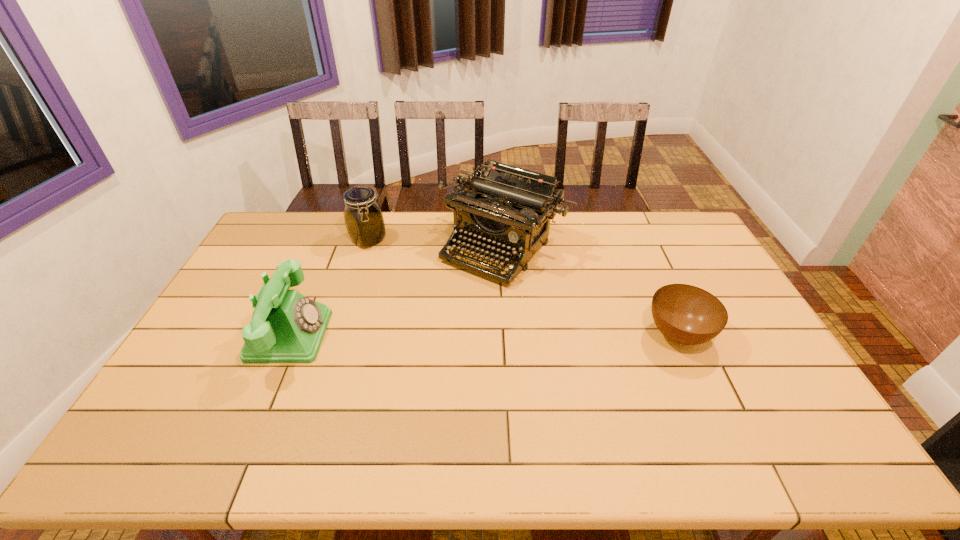
Locate an element on the screen. blank space at the far left corner of the desktop is located at coordinates (299, 219).

Identify the location of vacant space at the far right corner of the desktop. The height and width of the screenshot is (540, 960). (672, 237).

Identify the location of vacant area that lies between the second object from right to left and the shortest object. (591, 291).

Find the location of a particular element. free spot between the tallest object and the jar is located at coordinates (437, 244).

The height and width of the screenshot is (540, 960). What are the coordinates of `free space between the jar and the shortest object` in the screenshot? It's located at (523, 287).

This screenshot has width=960, height=540. I want to click on free space between the telephone and the jar, so click(329, 287).

Locate an element on the screen. This screenshot has height=540, width=960. blank region between the shortest object and the third object from left to right is located at coordinates (x=591, y=291).

Image resolution: width=960 pixels, height=540 pixels. Identify the location of free space between the jar and the second object from right to left. (437, 244).

The width and height of the screenshot is (960, 540). I want to click on free point between the shortest object and the jar, so click(523, 287).

You are a GUI agent. You are given a task and a screenshot of the screen. Output one action in this format:
    pyautogui.click(x=<x>, y=<y>)
    Task: Click on the free space between the telephone and the shortest object
    The width and height of the screenshot is (960, 540).
    Given the screenshot: What is the action you would take?
    pyautogui.click(x=484, y=335)